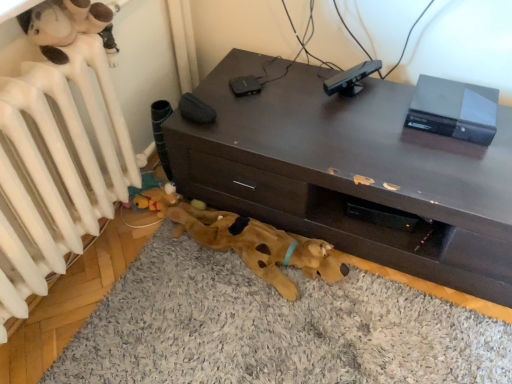
Question: Is white matte radiator at upper left inside the boundaries of brown plush dog bed at lower center, or outside?

Choices:
 (A) inside
 (B) outside

Answer: (B)

Question: Considering the positions of white matte radiator at upper left and brown plush dog bed at lower center in the image, is white matte radiator at upper left taller or shorter than brown plush dog bed at lower center?

Choices:
 (A) short
 (B) tall

Answer: (B)

Question: Which object is the closest to the dark brown wood desk at center?

Choices:
 (A) white matte radiator at upper left
 (B) black matte sensor at upper center
 (C) brown plush dog bed at lower center
 (D) brown plush dog at lower center

Answer: (D)

Question: Which object is the farthest from the black matte sensor at upper center?

Choices:
 (A) brown plush dog bed at lower center
 (B) brown plush dog at lower center
 (C) dark brown wood desk at center
 (D) white matte radiator at upper left

Answer: (D)